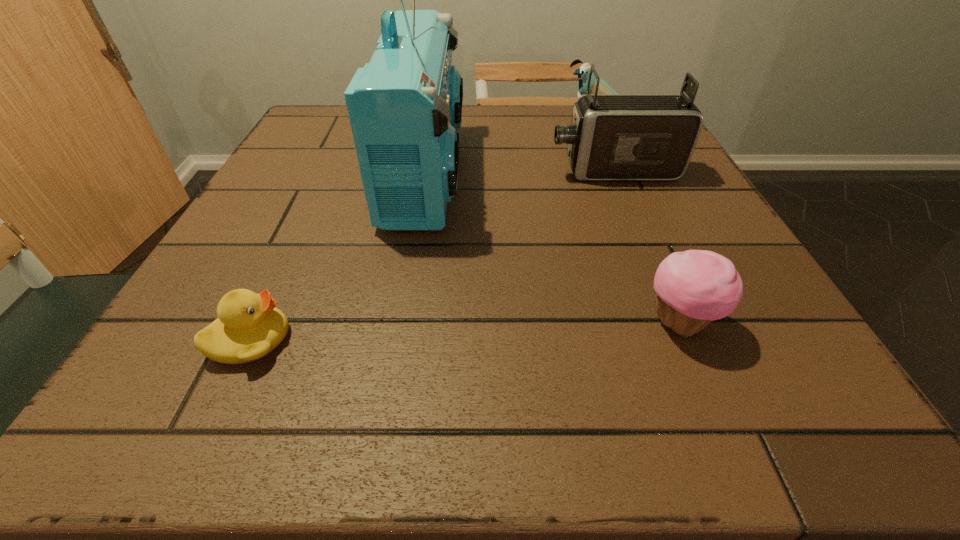
What are the coordinates of `free space between the fourth tallest object and the fourth object from right to left` in the screenshot? It's located at (553, 247).

Identify the location of free space between the fourth tallest object and the shortest object. Image resolution: width=960 pixels, height=540 pixels. (466, 332).

At what (x,y) coordinates should I click in order to perform the action: click on vacant area between the second tallest object and the leftmost object. Please return your answer as a coordinate pair (x, y). Image resolution: width=960 pixels, height=540 pixels. Looking at the image, I should click on (432, 255).

You are a GUI agent. You are given a task and a screenshot of the screen. Output one action in this format:
    pyautogui.click(x=<x>, y=<y>)
    Task: Click on the vacant space that is in between the fourth object from right to left and the fourth shortest object
    
    Given the screenshot: What is the action you would take?
    pyautogui.click(x=519, y=172)

You are a GUI agent. You are given a task and a screenshot of the screen. Output one action in this format:
    pyautogui.click(x=<x>, y=<y>)
    Task: Click on the free area in between the camcorder and the shortest object
    
    Given the screenshot: What is the action you would take?
    pyautogui.click(x=432, y=255)

You are a GUI agent. You are given a task and a screenshot of the screen. Output one action in this format:
    pyautogui.click(x=<x>, y=<y>)
    Task: Click on the vacant region between the duckling and the cupcake
    This screenshot has width=960, height=540.
    Given the screenshot: What is the action you would take?
    pyautogui.click(x=466, y=332)

This screenshot has height=540, width=960. Identify the location of vacant region between the third shortest object and the cupcake. (641, 222).

This screenshot has height=540, width=960. I want to click on empty location between the shortest object and the fourth shortest object, so click(432, 255).

Where is `empty space that is in between the duckling and the fourth object from right to left`? The image size is (960, 540). empty space that is in between the duckling and the fourth object from right to left is located at coordinates (338, 256).

Where is `vacant area that lies between the duckling and the third tallest object`? Image resolution: width=960 pixels, height=540 pixels. vacant area that lies between the duckling and the third tallest object is located at coordinates (x=427, y=231).